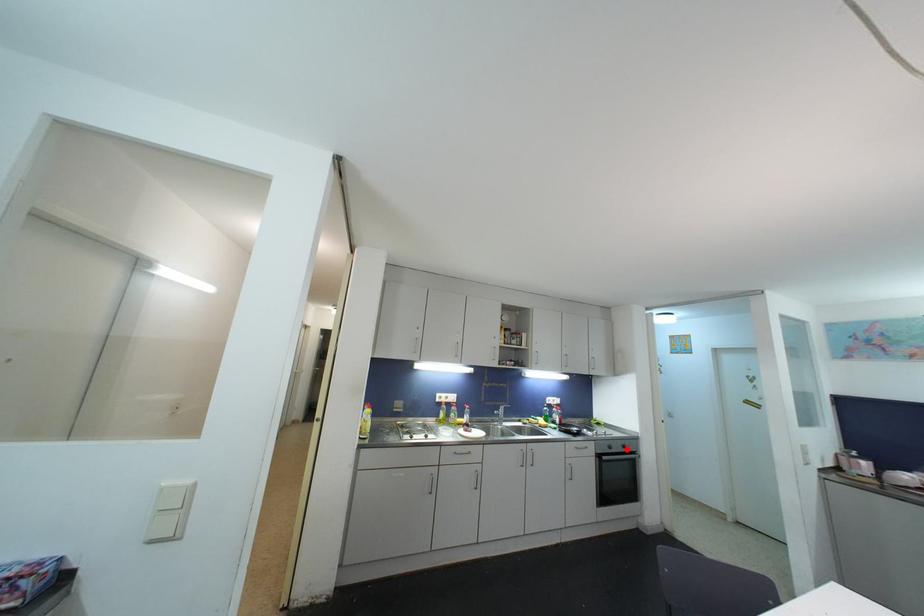
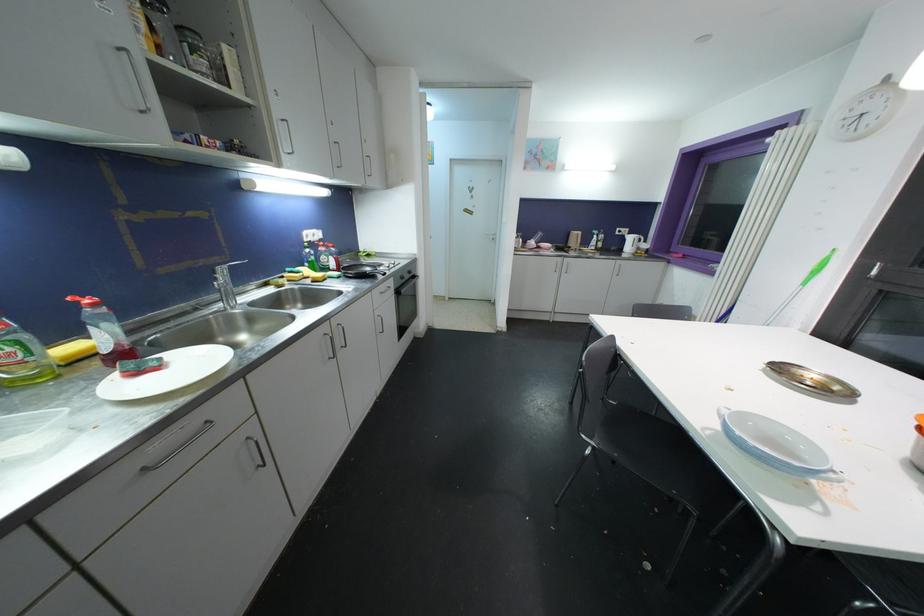
Question: I am providing you with two images of the same scene from different viewpoints. Given a red point in image1, look at the same physical point in image2. Is it:

Choices:
 (A) Closer to the viewpoint
 (B) Farther from the viewpoint

Answer: (A)